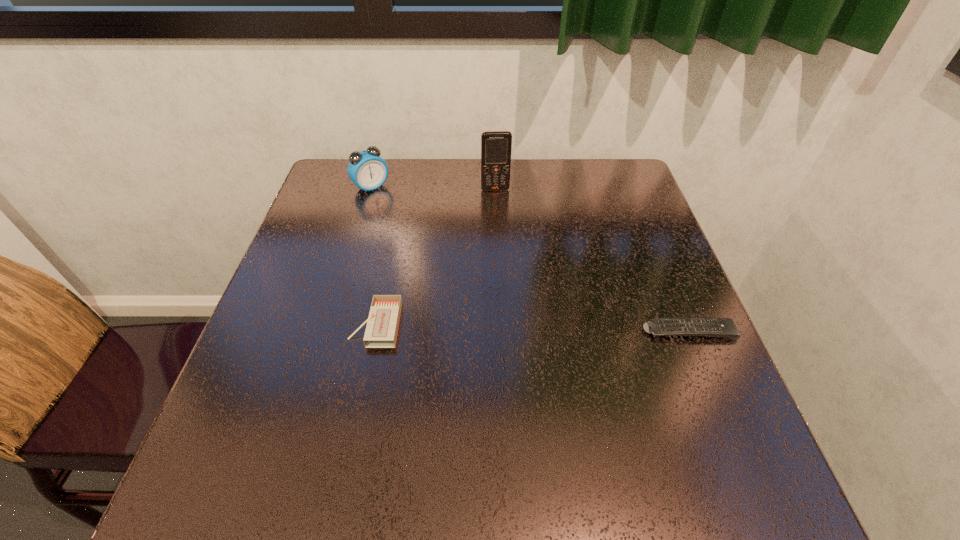
Where is `vacant space on the desktop that is between the matchbox and the shortest object and is positioned on the screen of the third object from left to right`? This screenshot has width=960, height=540. vacant space on the desktop that is between the matchbox and the shortest object and is positioned on the screen of the third object from left to right is located at coordinates (512, 327).

Identify the location of free space on the desktop that is between the matchbox and the shortest object and is positioned on the face of the second tallest object. click(x=504, y=327).